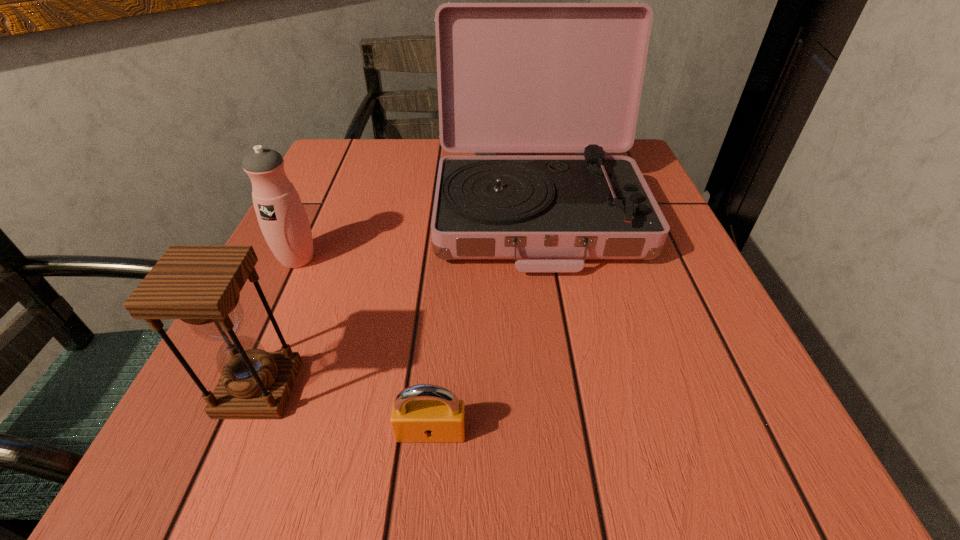
Locate an element on the screen. free space between the tallest object and the thermos bottle is located at coordinates (418, 235).

Where is `free space between the thermos bottle and the shortest object`? Image resolution: width=960 pixels, height=540 pixels. free space between the thermos bottle and the shortest object is located at coordinates (364, 346).

Where is `unoccupied area between the record player and the second nearest object`? This screenshot has width=960, height=540. unoccupied area between the record player and the second nearest object is located at coordinates (398, 300).

This screenshot has width=960, height=540. Identify the location of free point between the record player and the thermos bottle. (418, 235).

Find the location of a particular element. The width and height of the screenshot is (960, 540). free space that is in between the nearest object and the thermos bottle is located at coordinates (364, 346).

The height and width of the screenshot is (540, 960). I want to click on free point between the hourglass and the thermos bottle, so click(278, 324).

Where is `free space between the tallest object and the thermos bottle`? This screenshot has width=960, height=540. free space between the tallest object and the thermos bottle is located at coordinates (418, 235).

Image resolution: width=960 pixels, height=540 pixels. I want to click on free space between the hourglass and the padlock, so click(x=345, y=410).

At what (x,y) coordinates should I click in order to perform the action: click on vacant region between the hourglass and the thermos bottle. Please return your answer as a coordinate pair (x, y). The width and height of the screenshot is (960, 540). Looking at the image, I should click on (278, 324).

You are a GUI agent. You are given a task and a screenshot of the screen. Output one action in this format:
    pyautogui.click(x=<x>, y=<y>)
    Task: Click on the free area in between the tallest object and the hourglass
    The image size is (960, 540).
    Given the screenshot: What is the action you would take?
    (398, 300)